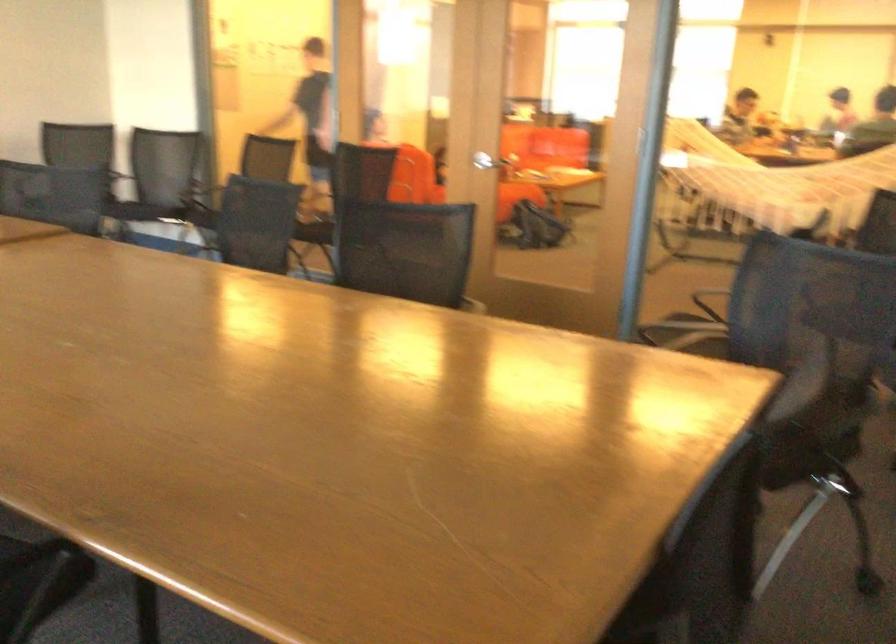
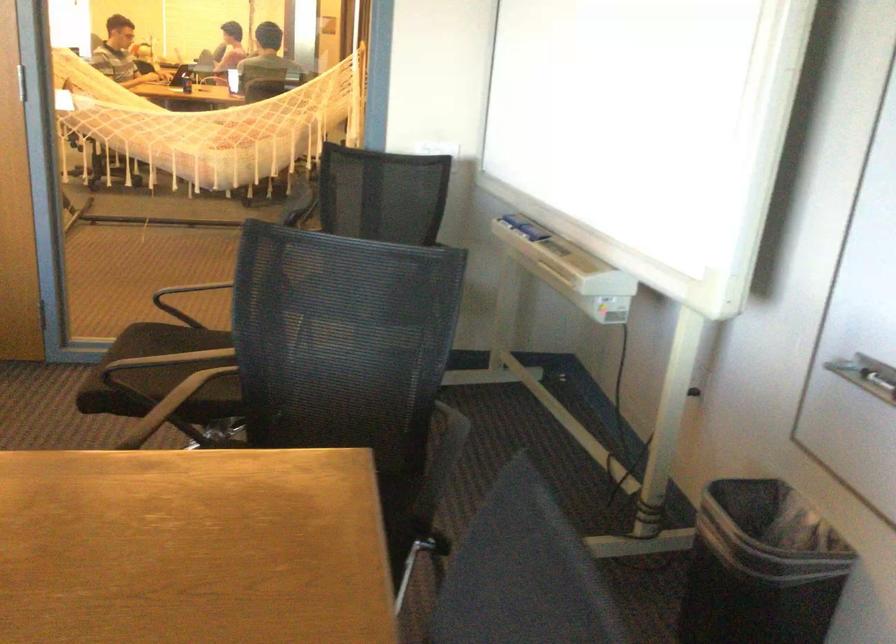
Question: Based on the continuous images, in which direction is the camera rotating? Reply with the corresponding letter.

Choices:
 (A) Left
 (B) Right
 (C) Up
 (D) Down

Answer: (B)